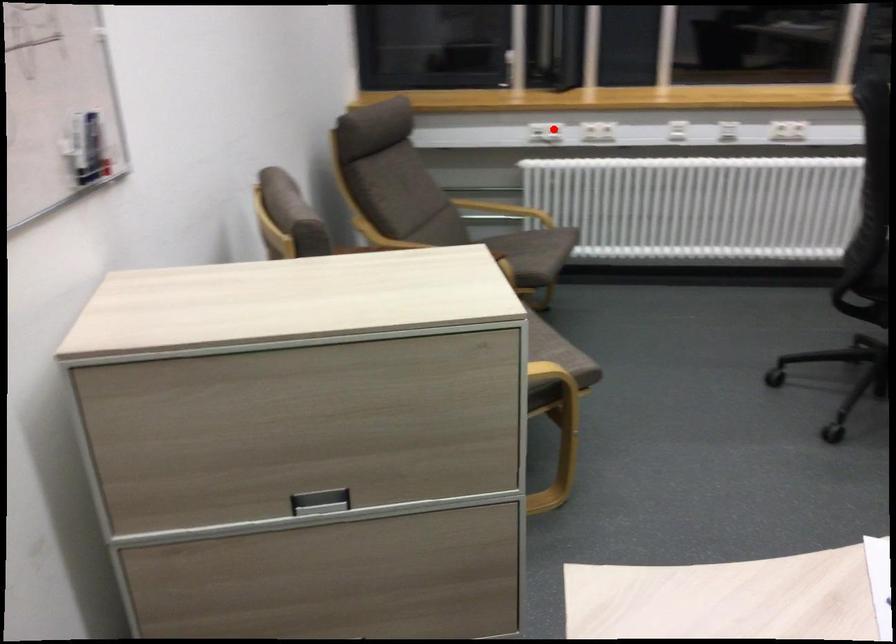
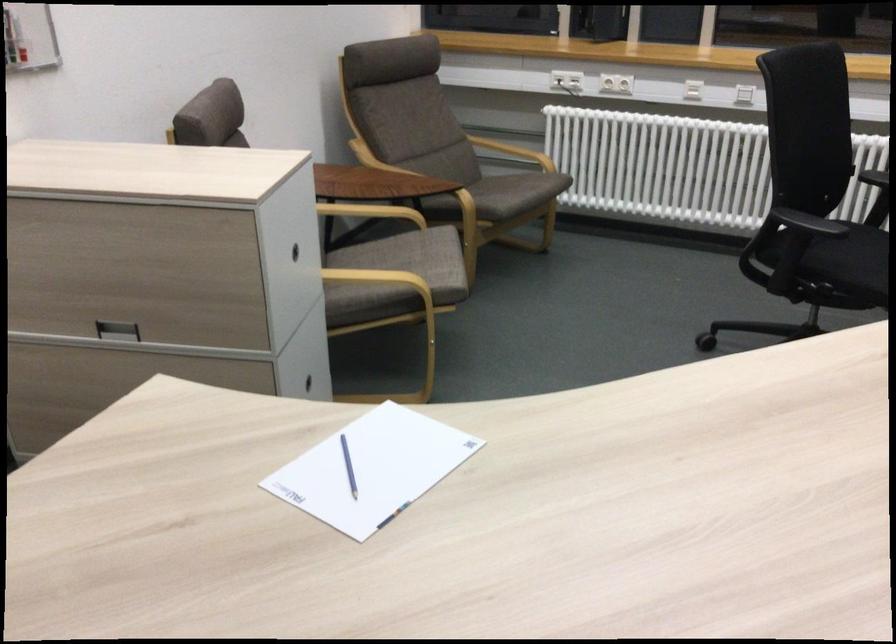
In the second image, find the point that corresponds to the highlighted location in the first image.

(566, 80)